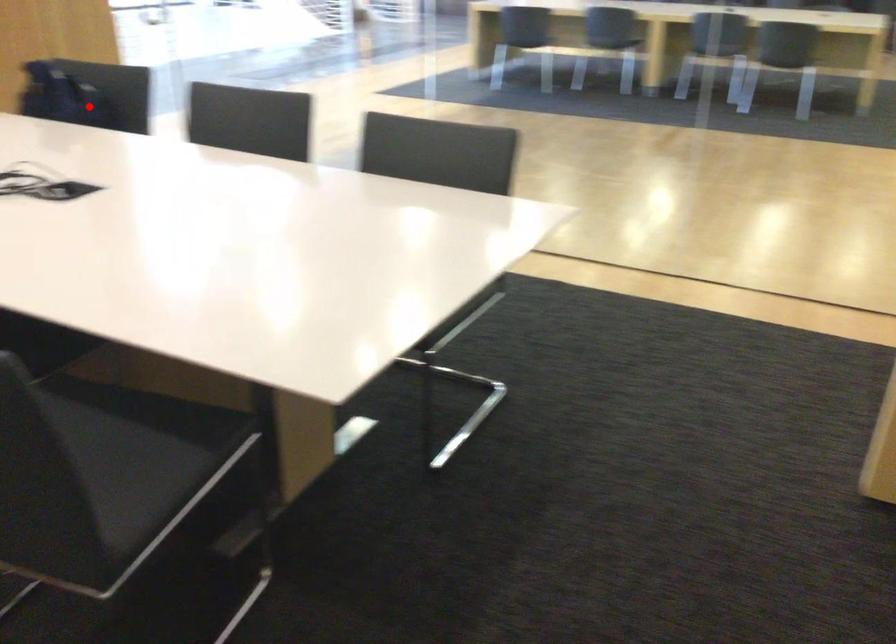
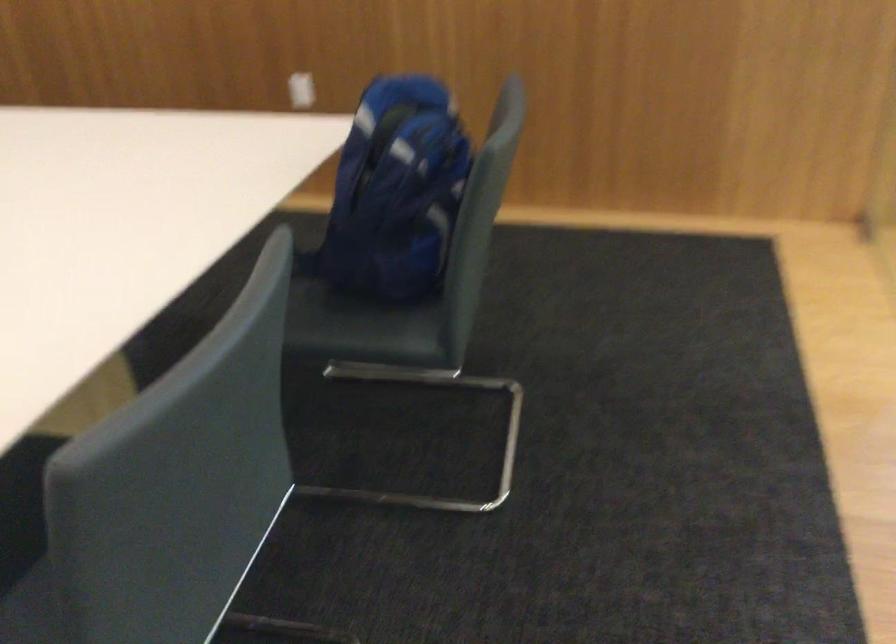
Question: I am providing you with two images of the same scene from different viewpoints. A red point is shown in image1. For the corresponding object point in image2, is it positioned nearer or farther from the camera?

Choices:
 (A) Nearer
 (B) Farther

Answer: (A)